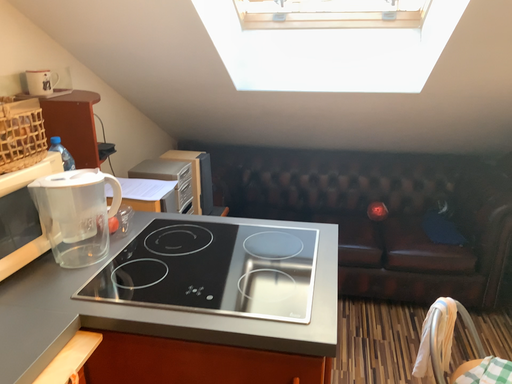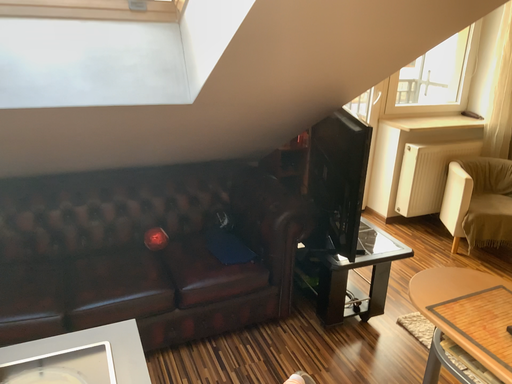
Question: How did the camera likely rotate when shooting the video?

Choices:
 (A) rotated right
 (B) rotated left

Answer: (A)